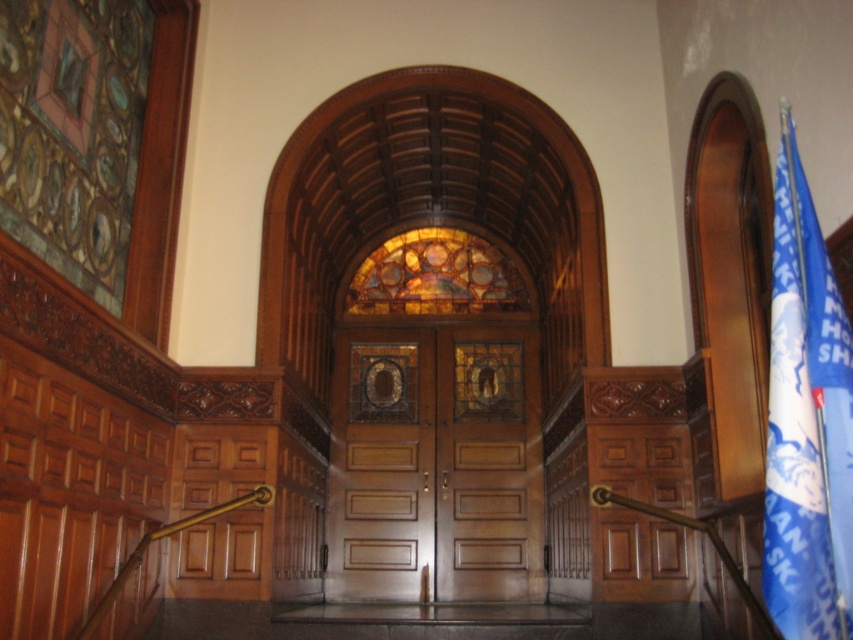
You are an interior designer assessing the entrance hall. You need to determine if the wooden door at center can be fully covered by a decorative curtain that is the same size as the stained glass window at center. Based on their sizes, what would you advise?

The wooden door at center is smaller than the stained glass window at center, so a curtain sized to match the stained glass window at center would be too large to fully cover the wooden door at center without excess fabric.

Looking at this image, you are a maintenance worker needing to reach the blue fabric flag at right from the door. The ladder you have is 4 meters long. Can you safely reach it using the ladder?

The blue fabric flag at right is 4.72 meters away from the door. Since the ladder is only 4 meters long, it is not long enough to safely reach the flag.

You are standing in the entrance hall and want to move from point A to point B. Point A is at coordinate point (465, 497) and point B is at coordinate point (457, 253). Given that you can only move forward, will you pass through the area where point B is located before reaching point A?

Point (465, 497) is in front of point (457, 253), so if you move forward from point A towards point B, you will reach point B before point A. However, since you are starting at point A, you cannot pass through point B before reaching your starting position. The question seems to have a logical inconsistency because moving forward from A to B means you are already at A and moving towards B, so you cannot pass B before A.